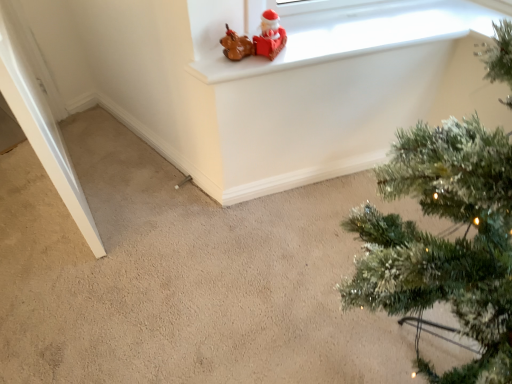
Question: Considering the relative sizes of matte white window frame at upper center and green textured christmas tree at upper right in the image provided, is matte white window frame at upper center smaller than green textured christmas tree at upper right?

Choices:
 (A) yes
 (B) no

Answer: (A)

Question: Is green textured christmas tree at upper right at the back of matte white window frame at upper center?

Choices:
 (A) no
 (B) yes

Answer: (A)

Question: Is matte white window frame at upper center thinner than green textured christmas tree at upper right?

Choices:
 (A) no
 (B) yes

Answer: (B)

Question: Does matte white window frame at upper center have a larger size compared to green textured christmas tree at upper right?

Choices:
 (A) no
 (B) yes

Answer: (A)

Question: Does matte white window frame at upper center have a lesser height compared to green textured christmas tree at upper right?

Choices:
 (A) no
 (B) yes

Answer: (B)

Question: Could you tell me if matte white window frame at upper center is turned towards green textured christmas tree at upper right?

Choices:
 (A) yes
 (B) no

Answer: (A)

Question: Does green textured christmas tree at upper right have a lesser width compared to matte brown figurine at upper center?

Choices:
 (A) yes
 (B) no

Answer: (B)

Question: Is green textured christmas tree at upper right in front of matte brown figurine at upper center?

Choices:
 (A) no
 (B) yes

Answer: (B)

Question: From a real-world perspective, is green textured christmas tree at upper right on matte brown figurine at upper center?

Choices:
 (A) no
 (B) yes

Answer: (A)

Question: Considering the relative sizes of green textured christmas tree at upper right and matte brown figurine at upper center in the image provided, is green textured christmas tree at upper right bigger than matte brown figurine at upper center?

Choices:
 (A) yes
 (B) no

Answer: (A)

Question: Is green textured christmas tree at upper right wider than matte brown figurine at upper center?

Choices:
 (A) yes
 (B) no

Answer: (A)

Question: Is green textured christmas tree at upper right not within matte brown figurine at upper center?

Choices:
 (A) yes
 (B) no

Answer: (A)

Question: Is matte white window frame at upper center at the back of green textured christmas tree at upper right?

Choices:
 (A) no
 (B) yes

Answer: (A)